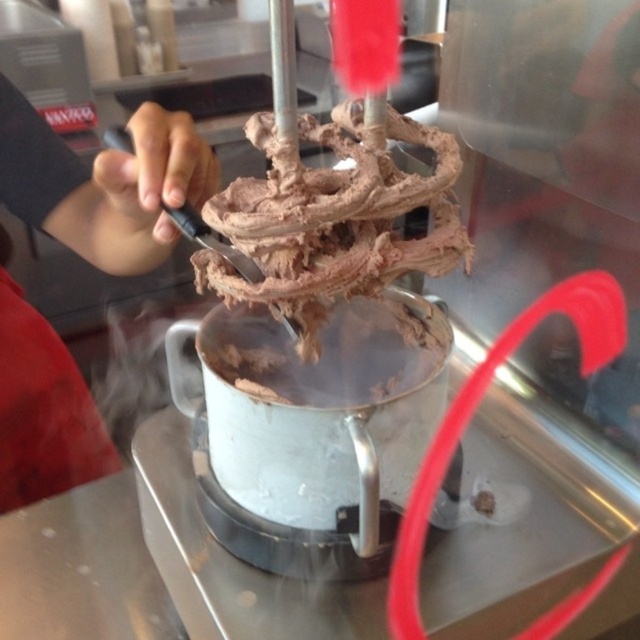
Does smooth skin hand at upper left appear on the right side of chocolate matte ice cream at center?

In fact, smooth skin hand at upper left is to the left of chocolate matte ice cream at center.

How much distance is there between smooth skin hand at upper left and chocolate matte ice cream at center?

A distance of 8.13 inches exists between smooth skin hand at upper left and chocolate matte ice cream at center.

Between point (172, 140) and point (248, 186), which one is positioned behind?

The point (172, 140) is behind.

Locate an element on the screen. smooth skin hand at upper left is located at coordinates (104, 182).